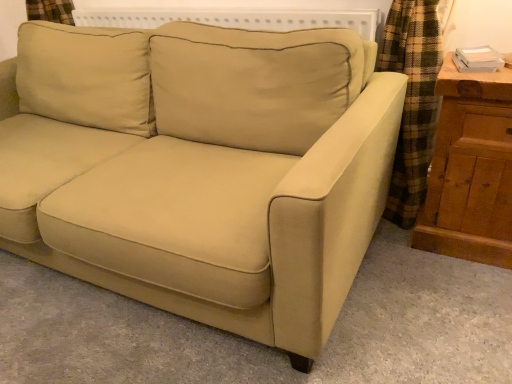
Where is `free space in front of wooden dresser at right`? free space in front of wooden dresser at right is located at coordinates (461, 290).